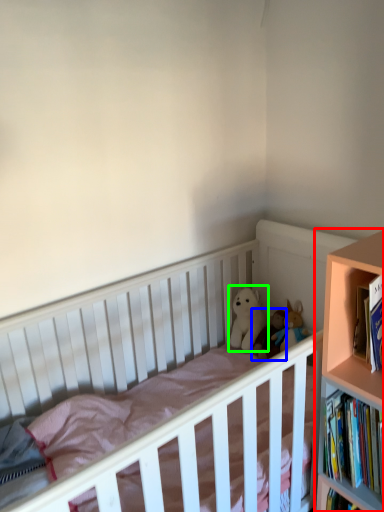
Question: Which object is positioned closest to bookcase (highlighted by a red box)? Select from doll (highlighted by a blue box) and doll (highlighted by a green box).

Choices:
 (A) doll
 (B) doll

Answer: (A)